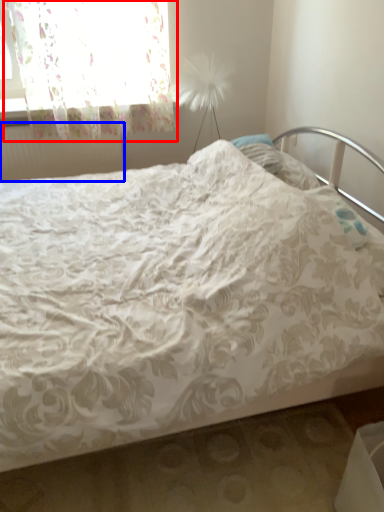
Question: Which of the following is the farthest to the observer, curtain (highlighted by a red box) or radiator (highlighted by a blue box)?

Choices:
 (A) curtain
 (B) radiator

Answer: (B)